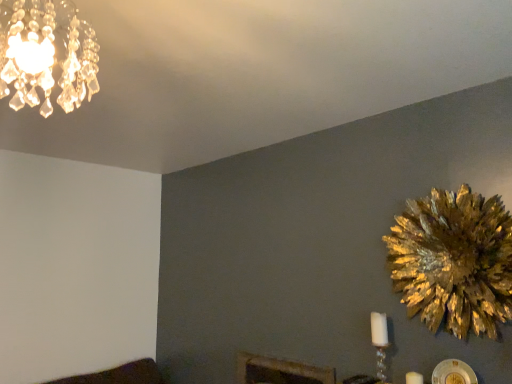
Question: Is white matte candle at lower right to the right of gold metallic flower at right from the viewer's perspective?

Choices:
 (A) no
 (B) yes

Answer: (A)

Question: Can you confirm if white matte candle at lower right is bigger than gold metallic flower at right?

Choices:
 (A) no
 (B) yes

Answer: (A)

Question: From a real-world perspective, is white matte candle at lower right on gold metallic flower at right?

Choices:
 (A) no
 (B) yes

Answer: (A)

Question: Does white matte candle at lower right lie behind gold metallic flower at right?

Choices:
 (A) no
 (B) yes

Answer: (B)

Question: From the image's perspective, does white matte candle at lower right appear lower than gold metallic flower at right?

Choices:
 (A) yes
 (B) no

Answer: (A)

Question: Is white matte candle at lower right aimed at gold metallic flower at right?

Choices:
 (A) yes
 (B) no

Answer: (B)

Question: Considering the relative sizes of gold metallic flower at right and white matte candle at lower right in the image provided, is gold metallic flower at right wider than white matte candle at lower right?

Choices:
 (A) yes
 (B) no

Answer: (A)

Question: Is white matte candle at lower right at the back of gold metallic flower at right?

Choices:
 (A) yes
 (B) no

Answer: (B)

Question: Is gold metallic flower at right smaller than white matte candle at lower right?

Choices:
 (A) no
 (B) yes

Answer: (A)

Question: Is gold metallic flower at right next to white matte candle at lower right and touching it?

Choices:
 (A) yes
 (B) no

Answer: (B)

Question: Is gold metallic flower at right to the right of white matte candle at lower right from the viewer's perspective?

Choices:
 (A) yes
 (B) no

Answer: (A)

Question: Is gold metallic flower at right not inside white matte candle at lower right?

Choices:
 (A) no
 (B) yes

Answer: (B)

Question: Is crystal glass chandelier at upper left outside white glass candle at lower right?

Choices:
 (A) no
 (B) yes

Answer: (B)